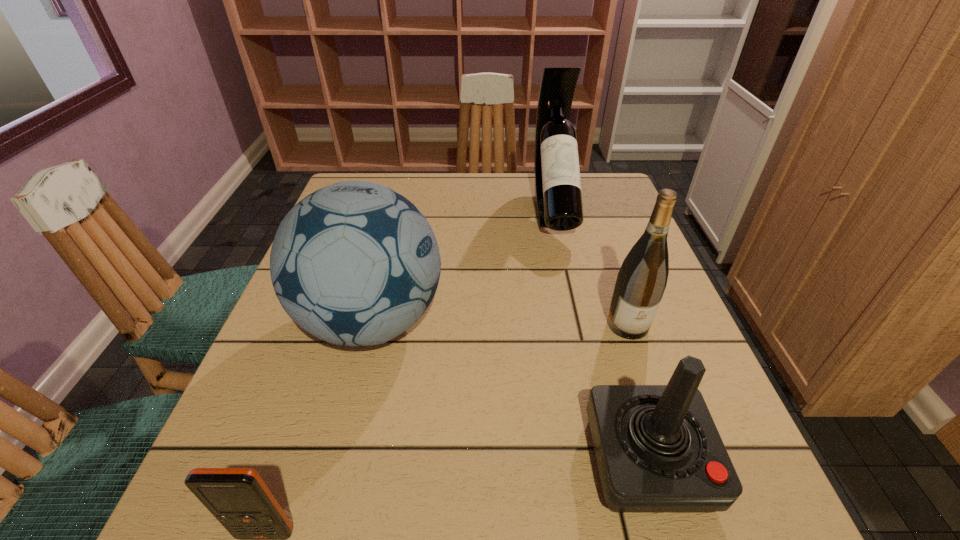
Where is `the farthest object`? This screenshot has height=540, width=960. the farthest object is located at coordinates (558, 196).

You are a GUI agent. You are given a task and a screenshot of the screen. Output one action in this format:
    pyautogui.click(x=<x>, y=<y>)
    Task: Click on the farther wine bottle
    
    Given the screenshot: What is the action you would take?
    pyautogui.click(x=558, y=196)

Identify the location of the right wine bottle. The width and height of the screenshot is (960, 540). (641, 281).

Find the location of `soccer ball`. soccer ball is located at coordinates (355, 263).

You are a GUI agent. You are given a task and a screenshot of the screen. Output one action in this format:
    pyautogui.click(x=<x>, y=<y>)
    Task: Click on the second shortest object
    The height and width of the screenshot is (540, 960).
    Given the screenshot: What is the action you would take?
    pyautogui.click(x=658, y=450)

Identify the location of joystick. The height and width of the screenshot is (540, 960). (658, 450).

This screenshot has width=960, height=540. Find the location of `vacant space located on the stand of the farthest object`. vacant space located on the stand of the farthest object is located at coordinates (575, 305).

Locate an element on the screen. The image size is (960, 540). vacant space located 0.300m on the label of the right wine bottle is located at coordinates (689, 505).

At what (x,y) coordinates should I click in order to perform the action: click on free space located on the side with brand of the soccer ball. Please return your answer as a coordinate pair (x, y). Looking at the image, I should click on (595, 321).

The height and width of the screenshot is (540, 960). I want to click on object that is at the far edge, so click(x=558, y=196).